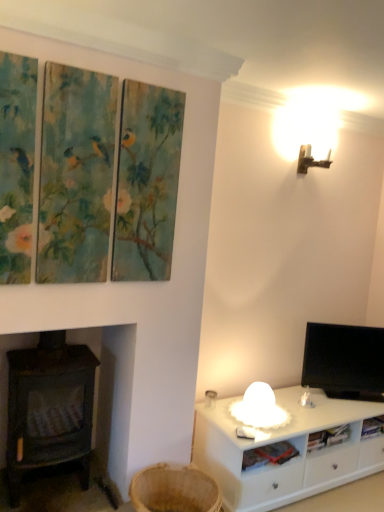
Where is `woven brown basket at lower left`? The image size is (384, 512). woven brown basket at lower left is located at coordinates click(x=174, y=489).

Measure the distance between metallic wall sconce at upper right and camera.

A distance of 2.83 meters exists between metallic wall sconce at upper right and camera.

Identify the location of metallic wall sconce at upper right. (310, 160).

The height and width of the screenshot is (512, 384). What are the coordinates of `white fabric table lamp at lower right` in the screenshot? It's located at (259, 408).

This screenshot has height=512, width=384. Identify the location of woven brown basket at lower left. (174, 489).

Between metallic wall sconce at upper right and woven brown basket at lower left, which one appears on the right side from the viewer's perspective?

From the viewer's perspective, metallic wall sconce at upper right appears more on the right side.

Can you confirm if metallic wall sconce at upper right is taller than woven brown basket at lower left?

Correct, metallic wall sconce at upper right is much taller as woven brown basket at lower left.

Is metallic wall sconce at upper right touching woven brown basket at lower left?

No, metallic wall sconce at upper right is not with woven brown basket at lower left.

I want to click on table lamp above the woven brown basket at lower left (from a real-world perspective), so [x=259, y=408].

In the scene shown: Are woven brown basket at lower left and white fabric table lamp at lower right located far from each other?

No, woven brown basket at lower left is not far from white fabric table lamp at lower right.

Considering the positions of point (147, 490) and point (242, 433), is point (147, 490) closer or farther from the camera than point (242, 433)?

Point (147, 490).

Considering the positions of objects woven brown basket at lower left and white fabric table lamp at lower right in the image provided, who is more to the right, woven brown basket at lower left or white fabric table lamp at lower right?

From the viewer's perspective, white fabric table lamp at lower right appears more on the right side.

From a real-world perspective, who is located lower, white fabric table lamp at lower right or white plastic shelf at lower right?

white plastic shelf at lower right, from a real-world perspective.

Which object is wider, white fabric table lamp at lower right or white plastic shelf at lower right?

Wider between the two is white fabric table lamp at lower right.

Based on their positions, is white fabric table lamp at lower right located to the left or right of white plastic shelf at lower right?

Based on their positions, white fabric table lamp at lower right is located to the left of white plastic shelf at lower right.

Is white fabric table lamp at lower right positioned with its back to white plastic shelf at lower right?

No, white plastic shelf at lower right is not at the back of white fabric table lamp at lower right.

Can you confirm if white plastic shelf at lower right is positioned to the right of white fabric table lamp at lower right?

Correct, you'll find white plastic shelf at lower right to the right of white fabric table lamp at lower right.

Who is shorter, white plastic shelf at lower right or white fabric table lamp at lower right?

With less height is white plastic shelf at lower right.

The width and height of the screenshot is (384, 512). Find the location of `table lamp above the white plastic shelf at lower right (from the image's perspective)`. table lamp above the white plastic shelf at lower right (from the image's perspective) is located at coordinates (259, 408).

How different are the orientations of white plastic shelf at lower right and white fabric table lamp at lower right in degrees?

They differ by 9.82 degrees in their facing directions.

From the picture: Between black glossy tv at right and dark brown wood burning stove at left, which one has larger width?

Wider between the two is dark brown wood burning stove at left.

Measure the distance between black glossy tv at right and dark brown wood burning stove at left.

black glossy tv at right is 5.06 feet from dark brown wood burning stove at left.

Is black glossy tv at right spatially inside dark brown wood burning stove at left, or outside of it?

black glossy tv at right is located beyond the bounds of dark brown wood burning stove at left.

Considering the relative sizes of black glossy tv at right and dark brown wood burning stove at left in the image provided, is black glossy tv at right smaller than dark brown wood burning stove at left?

Correct, black glossy tv at right occupies less space than dark brown wood burning stove at left.

Is dark brown wood burning stove at left oriented towards white fabric table lamp at lower right?

No, dark brown wood burning stove at left does not turn towards white fabric table lamp at lower right.

Can you confirm if dark brown wood burning stove at left is positioned to the left of white fabric table lamp at lower right?

Yes, dark brown wood burning stove at left is to the left of white fabric table lamp at lower right.

Looking at their sizes, would you say dark brown wood burning stove at left is wider or thinner than white fabric table lamp at lower right?

Considering their sizes, dark brown wood burning stove at left looks broader than white fabric table lamp at lower right.

Looking at this image, considering the positions of objects dark brown wood burning stove at left and white fabric table lamp at lower right in the image provided, who is in front, dark brown wood burning stove at left or white fabric table lamp at lower right?

dark brown wood burning stove at left is closer to the camera.

Which object is further away from the camera taking this photo, black glossy tv at right or woven brown basket at lower left?

black glossy tv at right is further from the camera.

Considering the sizes of black glossy tv at right and woven brown basket at lower left in the image, is black glossy tv at right bigger or smaller than woven brown basket at lower left?

In the image, black glossy tv at right appears to be larger than woven brown basket at lower left.

Between black glossy tv at right and woven brown basket at lower left, which one has more height?

black glossy tv at right is taller.

Find the location of a particular element. basket below the metallic wall sconce at upper right (from a real-world perspective) is located at coordinates (174, 489).

Find the location of `table lamp located behind the woven brown basket at lower left`. table lamp located behind the woven brown basket at lower left is located at coordinates (259, 408).

Which object lies further to the anchor point woven brown basket at lower left, white fabric table lamp at lower right or white plastic shelf at lower right?

Among the two, white fabric table lamp at lower right is located further to woven brown basket at lower left.

Considering their positions, is white fabric table lamp at lower right positioned closer to dark brown wood burning stove at left than metallic wall sconce at upper right?

The object closer to dark brown wood burning stove at left is white fabric table lamp at lower right.

Considering their positions, is white fabric table lamp at lower right positioned closer to dark brown wood burning stove at left than woven brown basket at lower left?

woven brown basket at lower left is closer to dark brown wood burning stove at left.

Considering their positions, is black glossy tv at right positioned further to metallic wall sconce at upper right than woven brown basket at lower left?

woven brown basket at lower left lies further to metallic wall sconce at upper right than the other object.

Based on their spatial positions, is black glossy tv at right or dark brown wood burning stove at left further from white plastic shelf at lower right?

dark brown wood burning stove at left.

Based on their spatial positions, is black glossy tv at right or white plastic shelf at lower right further from metallic wall sconce at upper right?

Based on the image, white plastic shelf at lower right appears to be further to metallic wall sconce at upper right.

Based on their spatial positions, is woven brown basket at lower left or metallic wall sconce at upper right closer to black glossy tv at right?

Among the two, woven brown basket at lower left is located nearer to black glossy tv at right.

Considering their positions, is metallic wall sconce at upper right positioned closer to black glossy tv at right than white fabric table lamp at lower right?

Based on the image, white fabric table lamp at lower right appears to be nearer to black glossy tv at right.

I want to click on table lamp between metallic wall sconce at upper right and woven brown basket at lower left from top to bottom, so click(259, 408).

Locate an element on the screen. basket between dark brown wood burning stove at left and black glossy tv at right is located at coordinates (174, 489).

This screenshot has width=384, height=512. In order to click on table lamp between metallic wall sconce at upper right and white plastic shelf at lower right vertically in this screenshot , I will do `click(259, 408)`.

Locate an element on the screen. wood burning stove between metallic wall sconce at upper right and woven brown basket at lower left in the up-down direction is located at coordinates (7, 378).